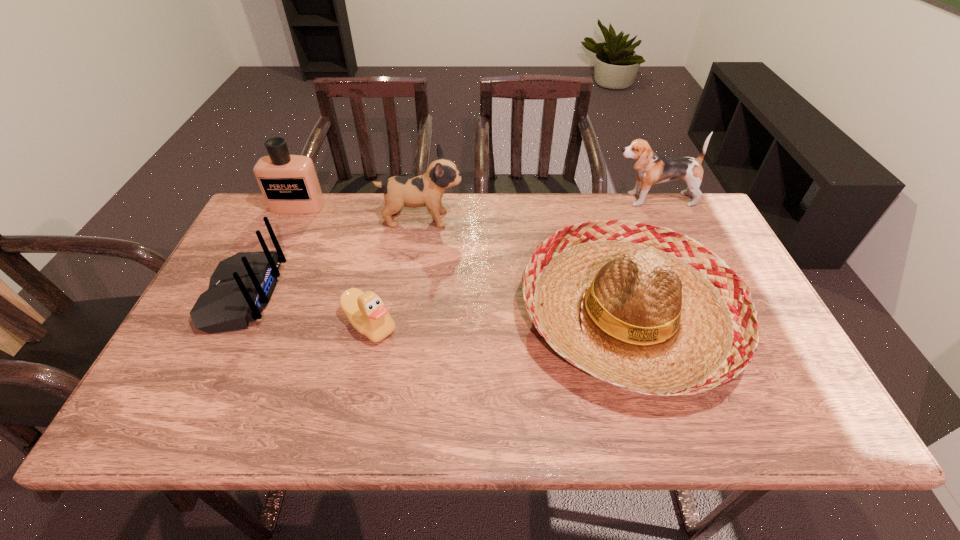
At what (x,y) coordinates should I click in order to perform the action: click on free spot located on the front label of the perfume. Please return your answer as a coordinate pair (x, y). This screenshot has height=540, width=960. Looking at the image, I should click on (287, 228).

Where is `vacant region located 0.390m on the left of the sombrero`? vacant region located 0.390m on the left of the sombrero is located at coordinates (366, 316).

Locate an element on the screen. free spot located on the back of the second shortest object is located at coordinates (392, 295).

Image resolution: width=960 pixels, height=540 pixels. Find the location of `free space located at the beak of the shortest object`. free space located at the beak of the shortest object is located at coordinates pyautogui.click(x=351, y=410).

Identify the location of perfume located at the far edge. Image resolution: width=960 pixels, height=540 pixels. (289, 183).

At what (x,y) coordinates should I click in order to perform the action: click on object positioned at the near edge. Please return your answer as a coordinate pair (x, y). This screenshot has height=540, width=960. Looking at the image, I should click on (644, 308).

Find the location of `perfume present at the left edge`. perfume present at the left edge is located at coordinates (289, 183).

Find the location of `router located at the left edge`. router located at the left edge is located at coordinates (242, 285).

In order to click on puppy positioned at the right edge in this screenshot , I will do `click(652, 168)`.

Image resolution: width=960 pixels, height=540 pixels. I want to click on sombrero at the right edge, so click(644, 308).